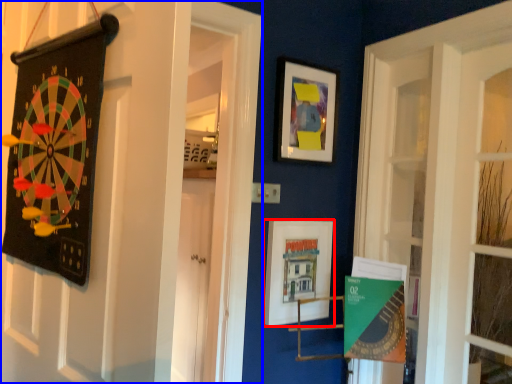
Question: Which point is further to the camera, picture frame (highlighted by a red box) or door (highlighted by a blue box)?

Choices:
 (A) picture frame
 (B) door

Answer: (A)